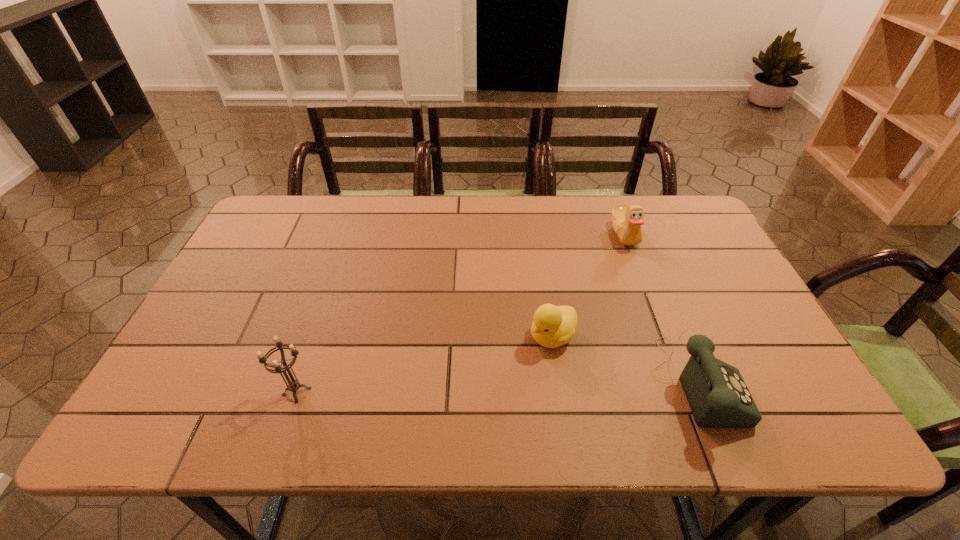
In order to click on vacant space in between the farther duck and the nearer duck in this screenshot , I will do `click(588, 285)`.

Identify the location of blank region between the third object from right to left and the farthest object. The width and height of the screenshot is (960, 540). (588, 285).

The height and width of the screenshot is (540, 960). I want to click on vacant region between the farthest object and the leftmost object, so click(x=461, y=313).

Identify the location of free point between the leftmost object and the right duck. This screenshot has height=540, width=960. (461, 313).

Where is `free space that is in between the left duck and the right duck`? The image size is (960, 540). free space that is in between the left duck and the right duck is located at coordinates (588, 285).

Find the location of a particular element. Image resolution: width=960 pixels, height=540 pixels. object that is the nearest to the farthest object is located at coordinates (553, 326).

The image size is (960, 540). Find the location of `the closest object to the right duck`. the closest object to the right duck is located at coordinates (553, 326).

Where is `vacant space that satisfies the following two spatial constraints: 1. on the front side of the left duck; 2. on the dial of the telephone`? This screenshot has height=540, width=960. vacant space that satisfies the following two spatial constraints: 1. on the front side of the left duck; 2. on the dial of the telephone is located at coordinates (560, 384).

This screenshot has height=540, width=960. I want to click on vacant space that satisfies the following two spatial constraints: 1. on the back side of the tallest object; 2. on the left side of the third object from right to left, so click(x=315, y=336).

Locate an element on the screen. This screenshot has width=960, height=540. vacant position in the image that satisfies the following two spatial constraints: 1. on the back side of the leftmost object; 2. on the left side of the farther duck is located at coordinates (349, 234).